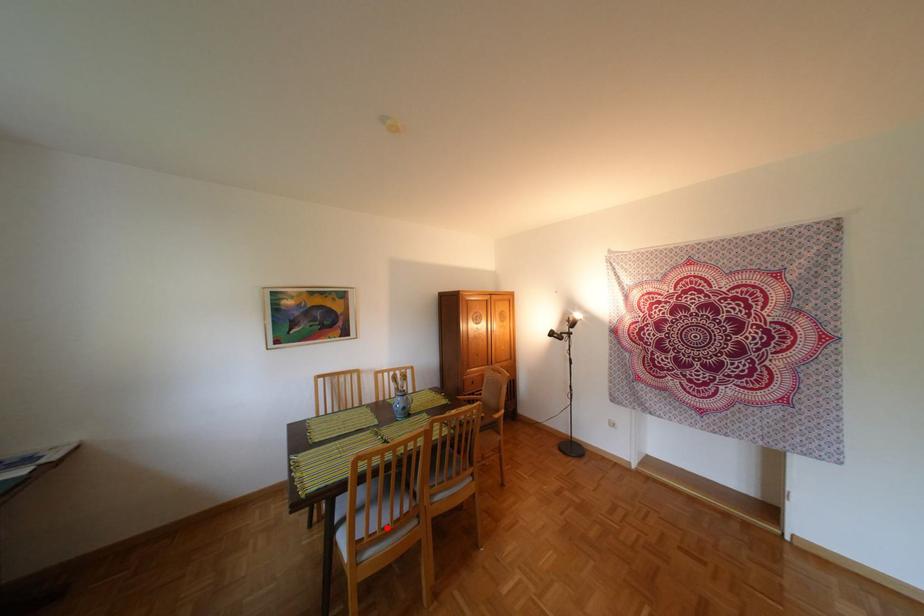
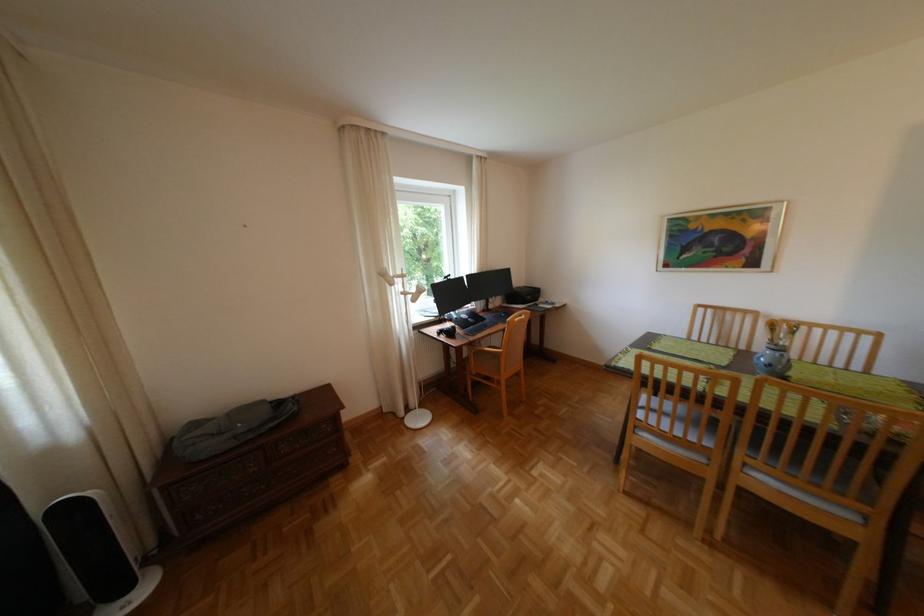
Locate, in the second image, the point that corresponds to the highlighted location in the first image.

(666, 422)